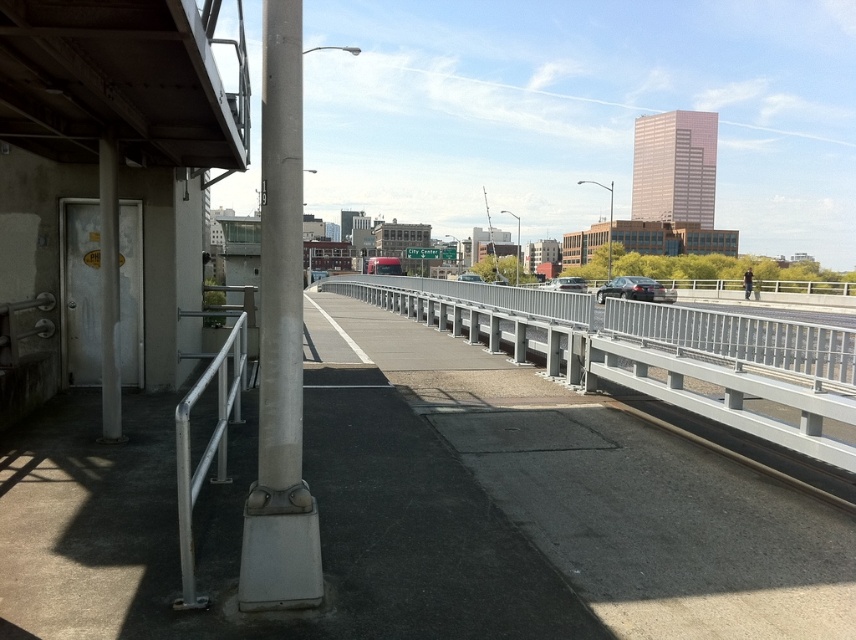
Question: Which of the following is the closest to the observer?

Choices:
 (A) (221, 467)
 (B) (103, 280)
 (C) (657, 284)

Answer: (A)

Question: Which is nearer to the silver metallic rail at left?

Choices:
 (A) satin silver pole at left
 (B) satin black sedan at center
 (C) metallic gray overpass at upper left

Answer: (A)

Question: Is silver metallic rail at left thinner than satin silver sedan at center?

Choices:
 (A) yes
 (B) no

Answer: (A)

Question: Is silver metallic rail at left positioned before satin black sedan at center?

Choices:
 (A) yes
 (B) no

Answer: (A)

Question: Can you confirm if metallic gray overpass at upper left is positioned to the left of white matte pole at left?

Choices:
 (A) yes
 (B) no

Answer: (A)

Question: Which of the following is the closest to the observer?

Choices:
 (A) (646, 284)
 (B) (68, 152)
 (C) (581, 289)

Answer: (B)